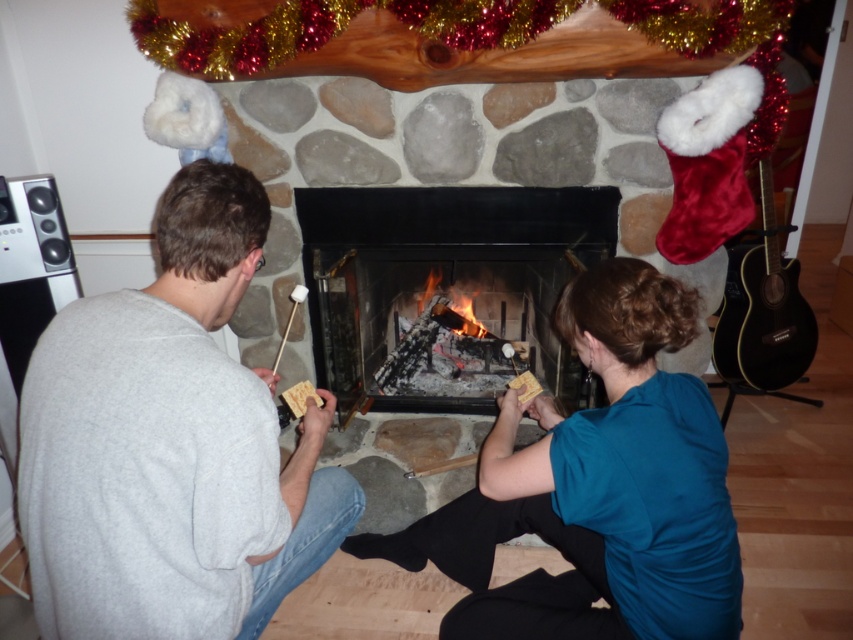
You are standing in the living room and want to see both the gray cotton shirt at center and the black stone fireplace at center. Which one would you need to look at first if you are facing the fireplace?

The gray cotton shirt at center is in front of the black stone fireplace at center, so you would need to look at the gray cotton shirt at center first before seeing the black stone fireplace at center behind it.

You are organizing a small Christmas party and need to place a 1.2 meter long Christmas tree in this room. The Christmas tree must be placed between the black wood guitar at right and the charcoal black wood at center. Is there enough space between them to fit the tree?

The black wood guitar at right is positioned on the right side of charcoal black wood at center. Since the guitar is to the right of the charcoal black wood, the distance between them isn

Based on the photo, you are organizing a small indoor concert in the living room where the fireplace is located. You need to place both the gray cotton shirt at center and the black wood guitar at right on the mantel above the fireplace. However, the mantel has limited space. Which object should you place first to ensure both can fit?

The gray cotton shirt at center has a lesser width compared to the black wood guitar at right, so you should place the black wood guitar at right first to ensure there is enough space for both items on the mantel.